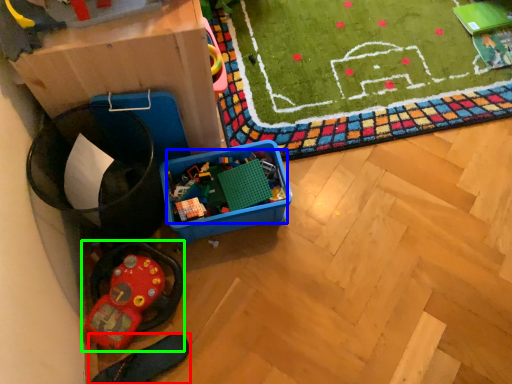
Question: Considering the real-world distances, which object is closest to footwear (highlighted by a red box)? toy (highlighted by a blue box) or toy (highlighted by a green box).

Choices:
 (A) toy
 (B) toy

Answer: (B)